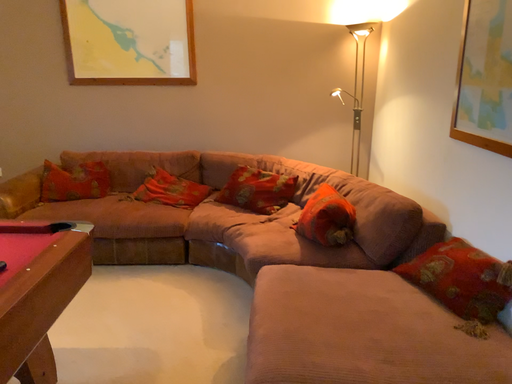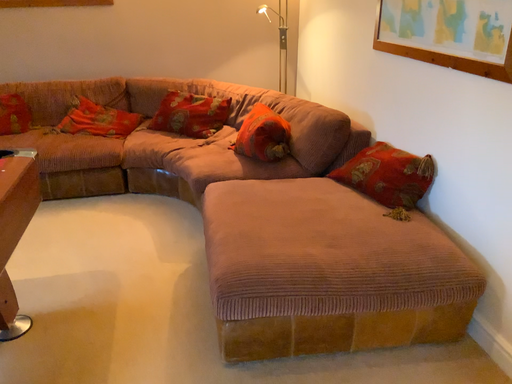
Question: How did the camera likely rotate when shooting the video?

Choices:
 (A) rotated upward
 (B) rotated downward

Answer: (B)